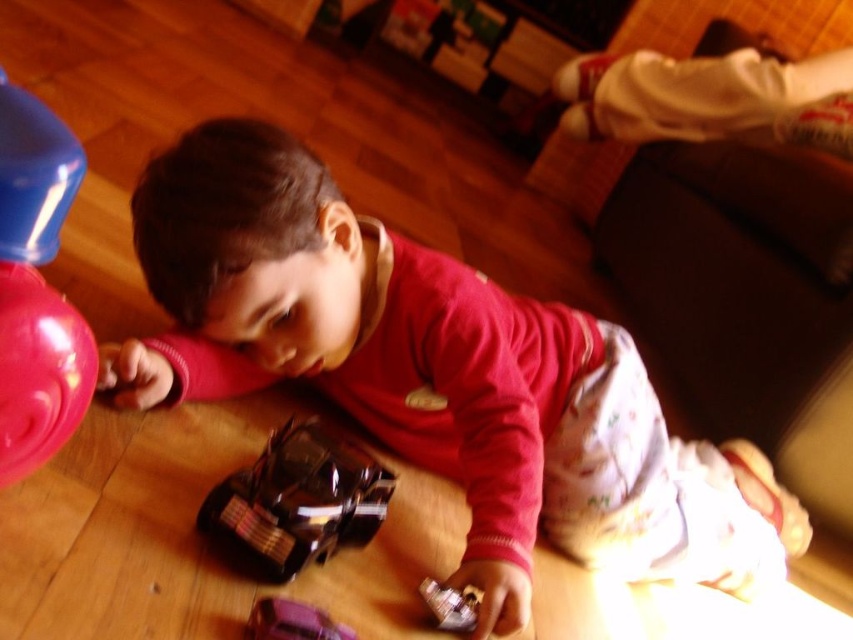
Does rubberized pink ball at left appear under shiny black car at lower left?

Actually, rubberized pink ball at left is above shiny black car at lower left.

Find the location of a particular element. rubberized pink ball at left is located at coordinates (36, 288).

Does shiny black car at lower left have a larger size compared to metallic purple car at lower center?

Correct, shiny black car at lower left is larger in size than metallic purple car at lower center.

Is point (343, 445) farther from viewer compared to point (293, 616)?

Yes, it is.

Locate an element on the screen. shiny black car at lower left is located at coordinates (299, 499).

Is point (285, 289) positioned after point (251, 616)?

Yes, it is.

Can you confirm if matte red shirt at center is shorter than metallic purple car at lower center?

Incorrect, matte red shirt at center's height does not fall short of metallic purple car at lower center's.

This screenshot has width=853, height=640. I want to click on matte red shirt at center, so click(x=437, y=376).